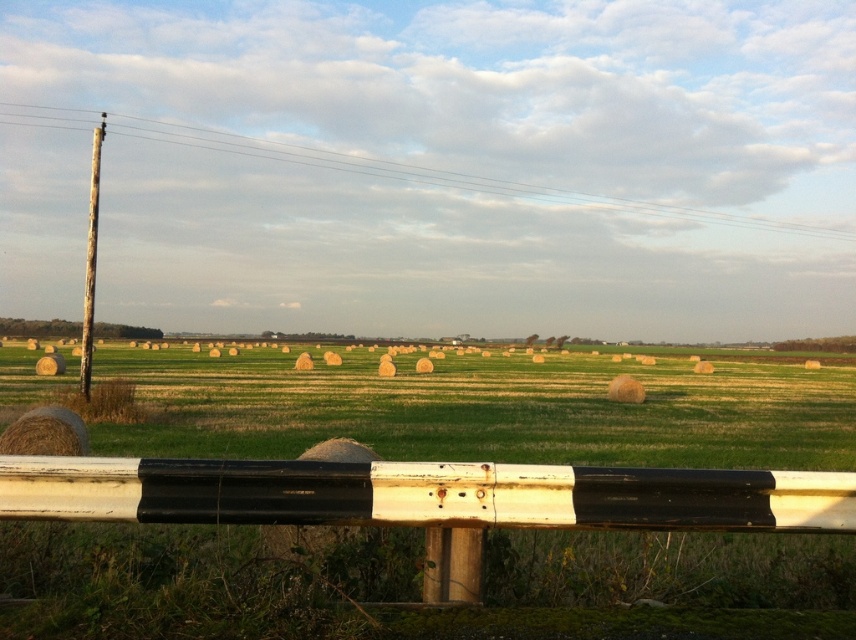
Can you confirm if yellow straw bales at center is wider than weathered wood pole at left?

Yes.

Is point (186, 378) positioned behind point (82, 321)?

Yes.

At what (x,y) coordinates should I click in order to perform the action: click on yellow straw bales at center. Please return your answer as a coordinate pair (x, y). The image size is (856, 640). Looking at the image, I should click on (483, 410).